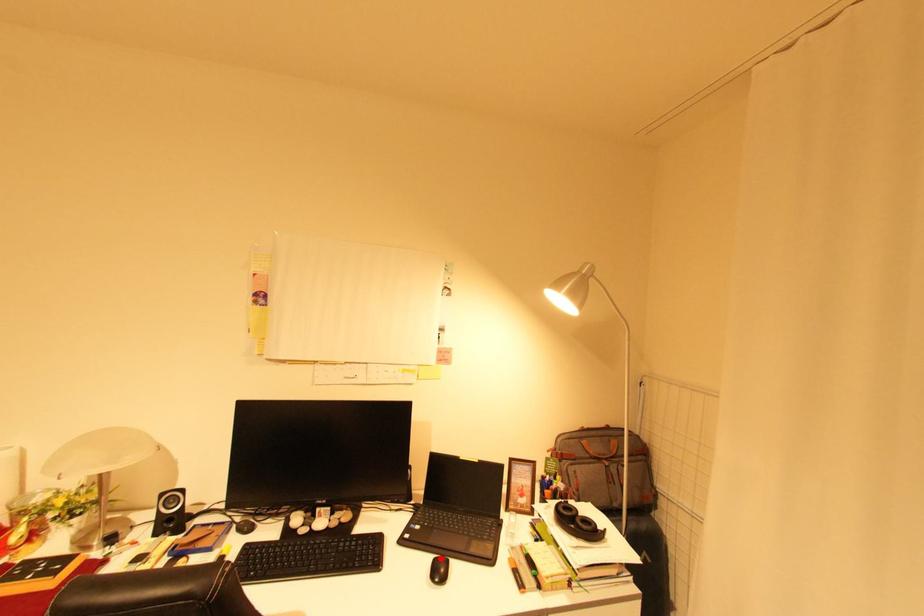
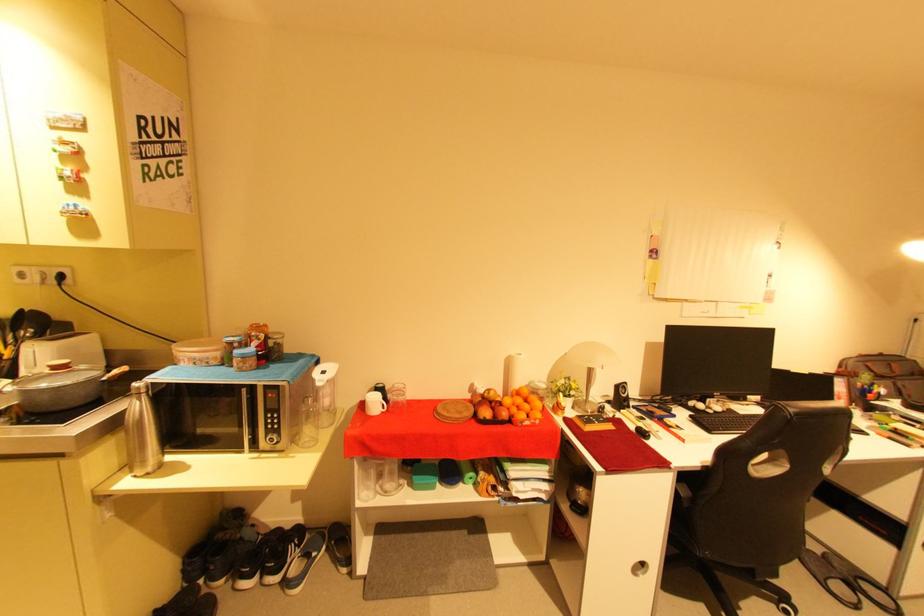
Question: I am providing you with two images of the same scene from different viewpoints. A red point is marked on the first image. Is the red point's position out of view in image 2?

Choices:
 (A) Yes
 (B) No

Answer: (A)